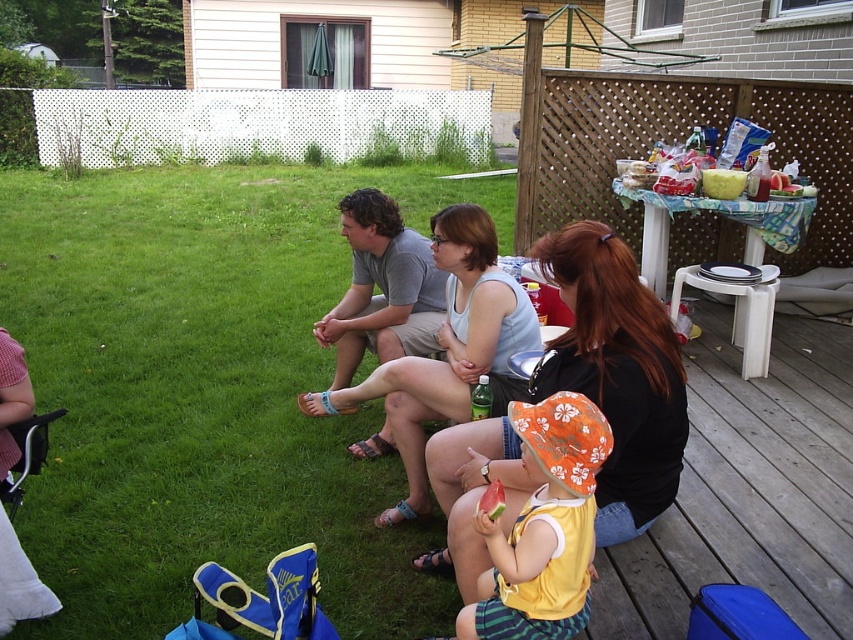
Which is behind, point (627, 259) or point (558, 429)?

Point (627, 259)

I want to click on matte black tank top at center, so (x=616, y=372).

Does light blue tank top at center appear on the left side of gray cotton shirt at center?

In fact, light blue tank top at center is to the right of gray cotton shirt at center.

I want to click on light blue tank top at center, so click(447, 352).

Is point (465, 260) less distant than point (350, 288)?

Yes, point (465, 260) is closer to viewer.

You are a GUI agent. You are given a task and a screenshot of the screen. Output one action in this format:
    pyautogui.click(x=<x>, y=<y>)
    Task: Click on the light blue tank top at center
    Image resolution: width=853 pixels, height=640 pixels.
    Given the screenshot: What is the action you would take?
    pyautogui.click(x=447, y=352)

Can you confirm if matte black tank top at center is smaller than light blue tank top at center?

Correct, matte black tank top at center occupies less space than light blue tank top at center.

Can you confirm if matte black tank top at center is positioned to the left of light blue tank top at center?

No, matte black tank top at center is not to the left of light blue tank top at center.

Which is in front, point (602, 241) or point (419, 364)?

Positioned in front is point (602, 241).

Where is `matte black tank top at center`? This screenshot has height=640, width=853. matte black tank top at center is located at coordinates (616, 372).